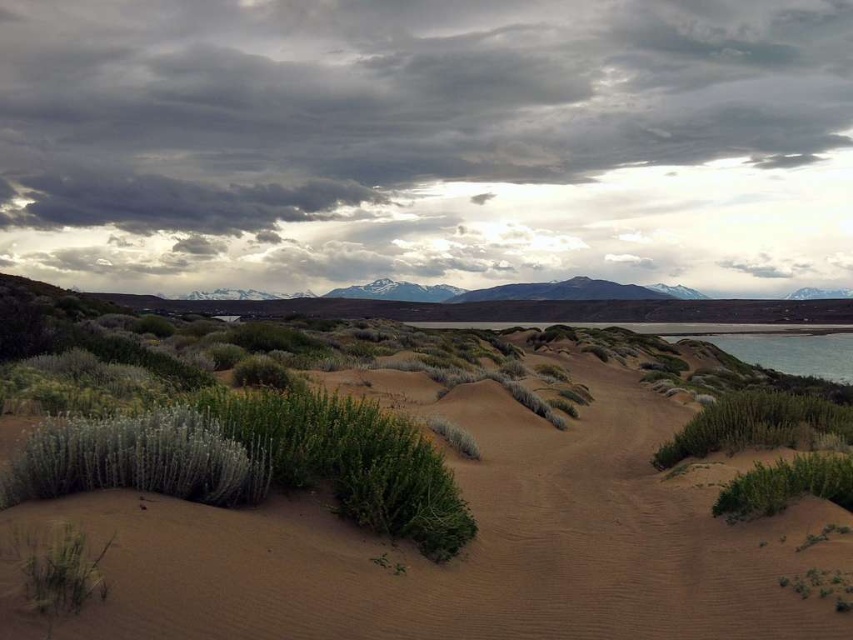
Based on the photo, you are standing at the center of the desert scene and want to locate the green fuzzy bush at lower left. According to the coordinates provided, in which direction should you look to find it?

The green fuzzy bush at lower left is located at point coordinates, so you should look to your lower left direction to find it.

You are a hiker trying to cross the desert and need to navigate between the green fuzzy bush at lower left and the green leafy bush at lower right. Given that your water supply can only last for a 70 feet journey, will you be able to make it between these two bushes without running out?

The distance between the green fuzzy bush at lower left and the green leafy bush at lower right is 74.31 feet, which exceeds your 70 feet water supply limit. Therefore, you will not have enough water to safely travel between them.